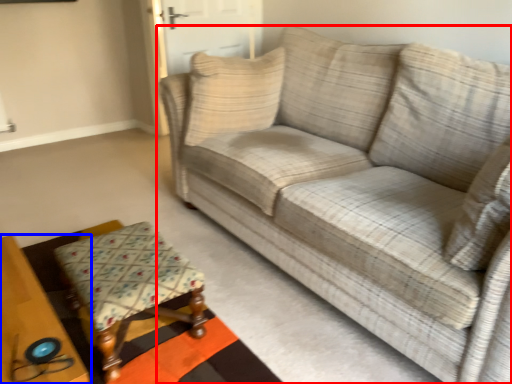
Question: Which object appears closest to the camera in this image, studio couch (highlighted by a red box) or table (highlighted by a blue box)?

Choices:
 (A) studio couch
 (B) table

Answer: (A)